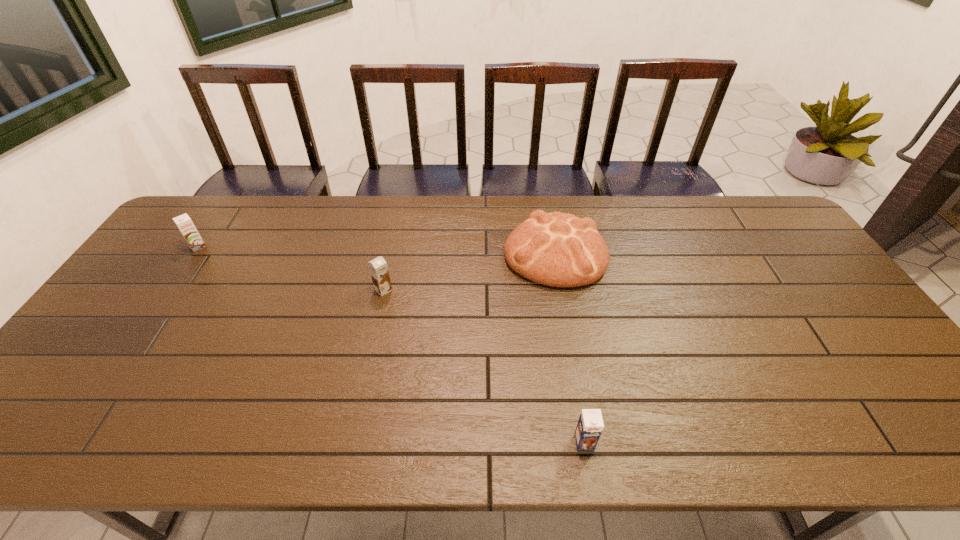
Find the location of `bread`. bread is located at coordinates pyautogui.click(x=555, y=249).

The width and height of the screenshot is (960, 540). I want to click on the farthest chocolate milk, so click(184, 223).

The image size is (960, 540). I want to click on the leftmost chocolate milk, so click(184, 223).

Locate an element on the screen. the second nearest chocolate milk is located at coordinates (378, 267).

Identify the location of the third object from right to left. Image resolution: width=960 pixels, height=540 pixels. (378, 267).

Where is `the nearest object`? The height and width of the screenshot is (540, 960). the nearest object is located at coordinates (590, 425).

This screenshot has width=960, height=540. Find the location of `the nearest chocolate milk`. the nearest chocolate milk is located at coordinates (590, 425).

Locate an element on the screen. free space located on the front of the bread is located at coordinates tap(573, 350).

Find the location of a particular element. This screenshot has height=540, width=960. vacant space located 0.340m on the front of the leftmost chocolate milk is located at coordinates (134, 340).

In order to click on vacant space located 0.080m on the front of the second nearest chocolate milk in this screenshot , I will do `click(377, 318)`.